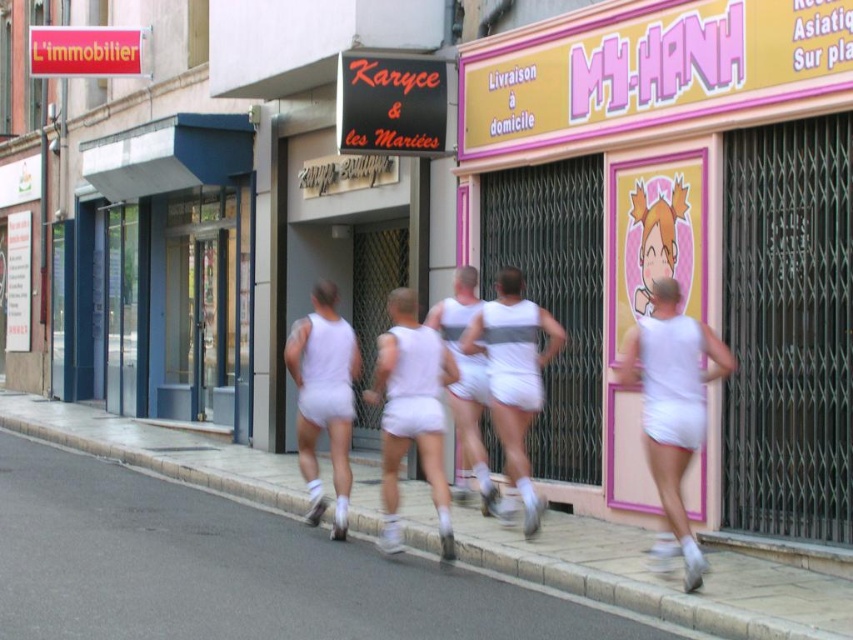
Is white matte shorts at right positioned behind white cotton shorts at center?

That is False.

Does point (659, 396) come behind point (332, 307)?

No, it is in front of (332, 307).

Locate an element on the screen. The height and width of the screenshot is (640, 853). white matte shorts at right is located at coordinates (672, 406).

Locate an element on the screen. The image size is (853, 640). pink matte sign at center is located at coordinates (683, 228).

Between pink matte sign at center and white cotton shorts at center, which one is positioned lower?

Positioned lower is white cotton shorts at center.

Find the location of `pink matte sign at center`. pink matte sign at center is located at coordinates (683, 228).

Is pink matte sign at center smaller than white concrete curb at lower center?

Actually, pink matte sign at center might be larger than white concrete curb at lower center.

Is point (601, 324) positioned behind point (654, 596)?

That is True.

Where is `pink matte sign at center`? The height and width of the screenshot is (640, 853). pink matte sign at center is located at coordinates click(x=683, y=228).